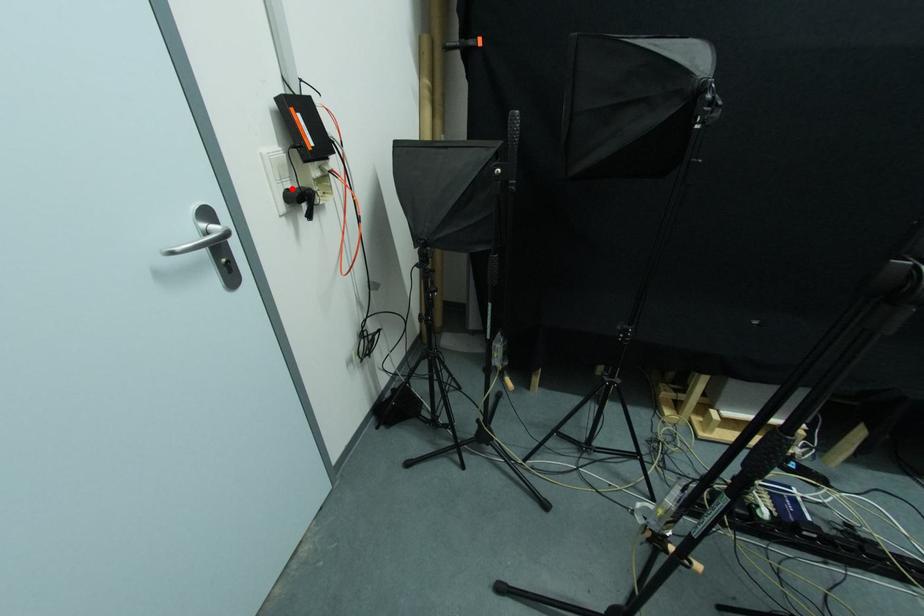
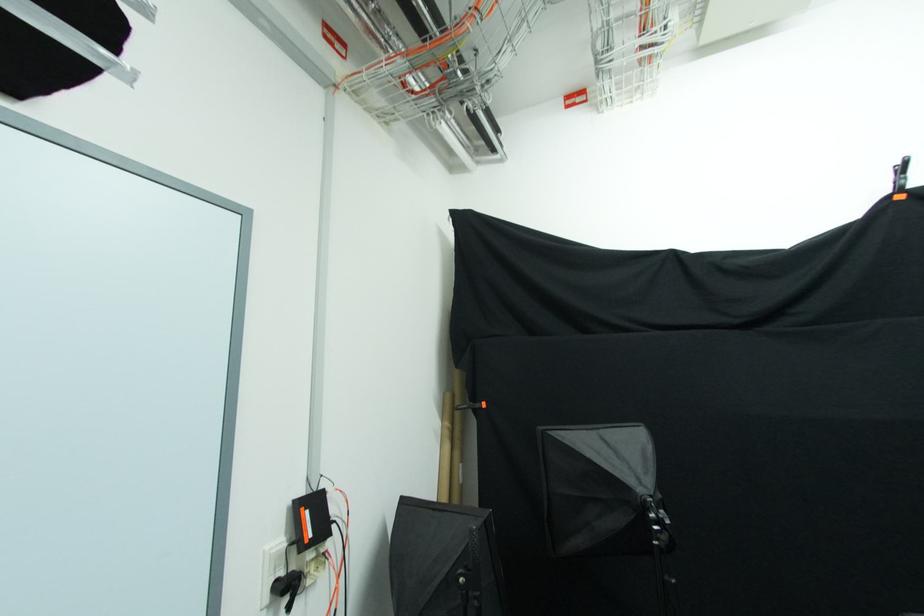
In the second image, find the point that corresponds to the highlighted location in the first image.

(285, 577)